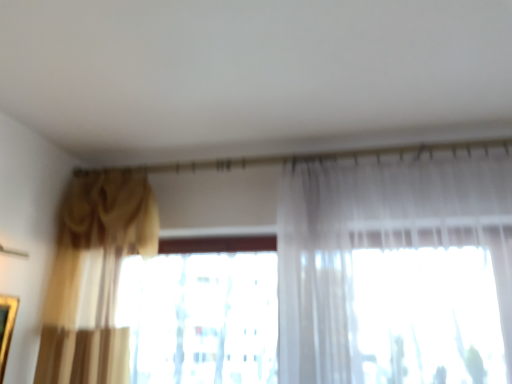
Question: Based on their positions, is gold textured curtain at left located to the left or right of translucent fabric at center?

Choices:
 (A) right
 (B) left

Answer: (B)

Question: Relative to translucent fabric at center, is gold textured curtain at left in front or behind?

Choices:
 (A) front
 (B) behind

Answer: (A)

Question: Is gold textured curtain at left taller or shorter than translucent fabric at center?

Choices:
 (A) short
 (B) tall

Answer: (B)

Question: Would you say translucent fabric at center is inside or outside gold textured curtain at left?

Choices:
 (A) outside
 (B) inside

Answer: (A)

Question: Is translucent fabric at center bigger or smaller than gold textured curtain at left?

Choices:
 (A) small
 (B) big

Answer: (A)

Question: Considering the relative positions of translucent fabric at center and gold textured curtain at left in the image provided, is translucent fabric at center to the left or to the right of gold textured curtain at left?

Choices:
 (A) left
 (B) right

Answer: (B)

Question: Is translucent fabric at center in front of or behind gold textured curtain at left in the image?

Choices:
 (A) behind
 (B) front

Answer: (A)